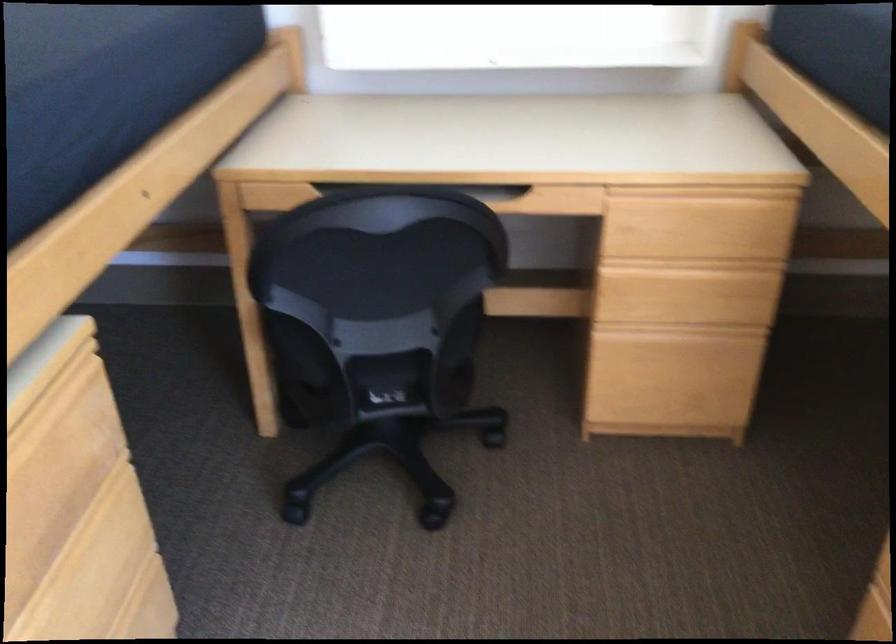
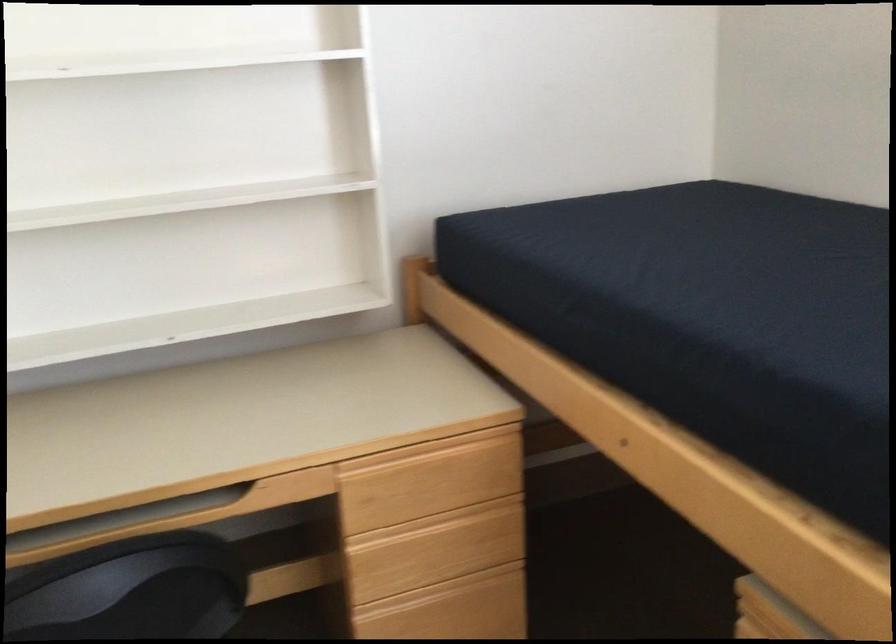
The point at (683, 190) is marked in the first image. Where is the corresponding point in the second image?

(417, 451)